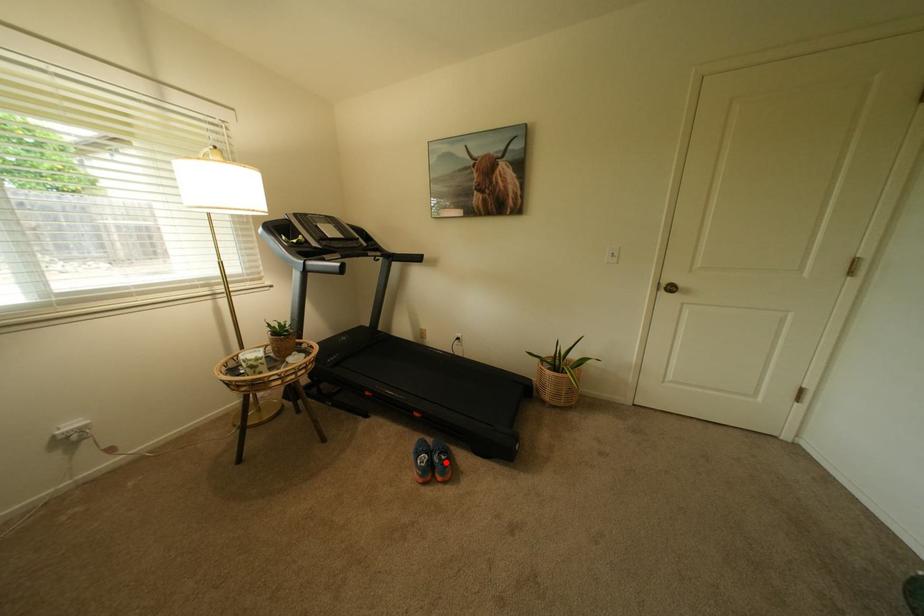
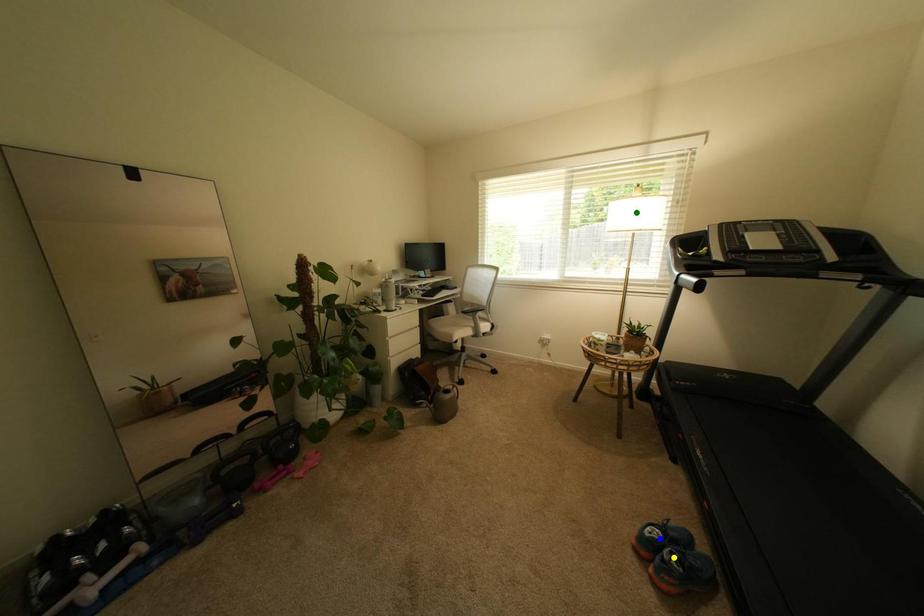
Question: I am providing you with two images of the same scene from different viewpoints. A red point is marked on the first image. You are given multiple points on the second image. In image 2, which mark is for the same physical point as the one in image 1?

Choices:
 (A) blue point
 (B) green point
 (C) yellow point

Answer: (C)